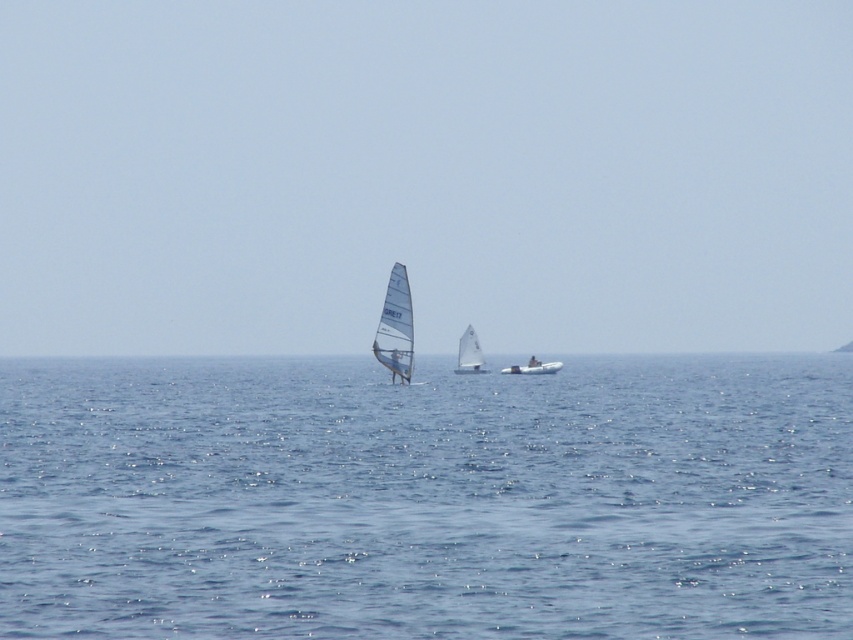
Question: Observing the image, what is the correct spatial positioning of transparent sailboat at center in reference to white matte dinghy at center?

Choices:
 (A) right
 (B) left

Answer: (A)

Question: Which point is farther to the camera?

Choices:
 (A) blue water at center
 (B) white matte dinghy at center

Answer: (B)

Question: Is white matte sailboat at center positioned at the back of white matte dinghy at center?

Choices:
 (A) yes
 (B) no

Answer: (B)

Question: Is transparent sailboat at center smaller than white matte dinghy at center?

Choices:
 (A) yes
 (B) no

Answer: (B)

Question: Which point is farther to the camera?

Choices:
 (A) (550, 100)
 (B) (531, 371)
 (C) (408, 348)

Answer: (A)

Question: Which point is farther from the camera taking this photo?

Choices:
 (A) (170, 211)
 (B) (544, 362)
 (C) (804, 406)
 (D) (399, 305)

Answer: (A)